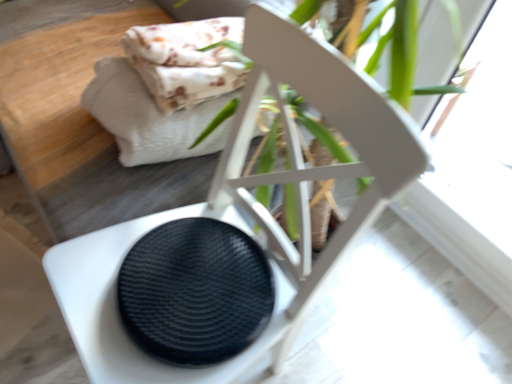
What are the coordinates of `black mesh shoe at center` in the screenshot? It's located at (195, 291).

The image size is (512, 384). What do you see at coordinates (195, 291) in the screenshot? I see `black mesh shoe at center` at bounding box center [195, 291].

What are the coordinates of `black mesh shoe at center` in the screenshot? It's located at (195, 291).